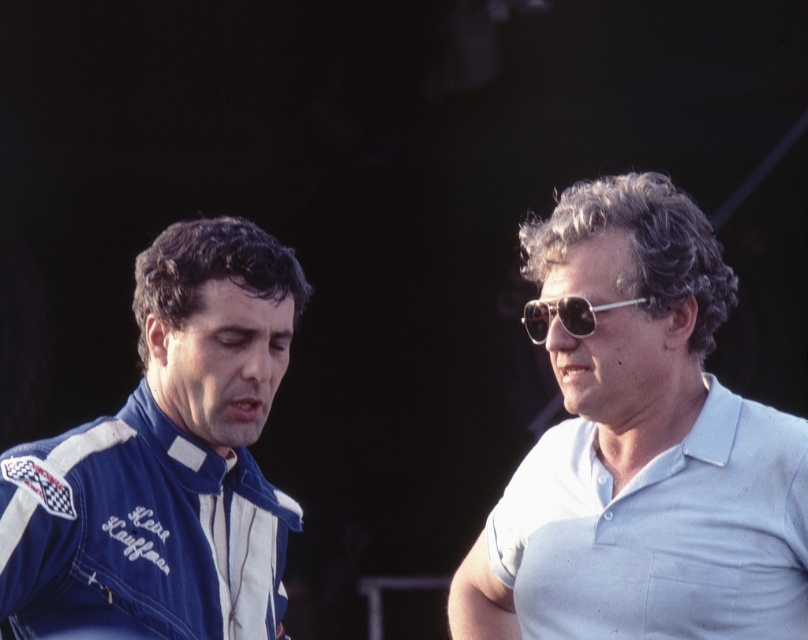
Question: Can you confirm if light blue cotton polo shirt at right is smaller than metallic silver sunglasses at upper right?

Choices:
 (A) no
 (B) yes

Answer: (A)

Question: Which object is positioned farthest from the metallic silver sunglasses at upper right?

Choices:
 (A) blue fabric jacket at left
 (B) light blue cotton polo shirt at right

Answer: (A)

Question: Where is light blue cotton polo shirt at right located in relation to metallic silver sunglasses at upper right in the image?

Choices:
 (A) left
 (B) right

Answer: (B)

Question: Which object is closer to the camera taking this photo?

Choices:
 (A) light blue cotton polo shirt at right
 (B) blue fabric jacket at left

Answer: (B)

Question: Can you confirm if blue fabric jacket at left is positioned to the right of metallic silver sunglasses at upper right?

Choices:
 (A) no
 (B) yes

Answer: (A)

Question: Among these points, which one is farthest from the camera?

Choices:
 (A) click(545, 330)
 (B) click(697, 256)

Answer: (A)